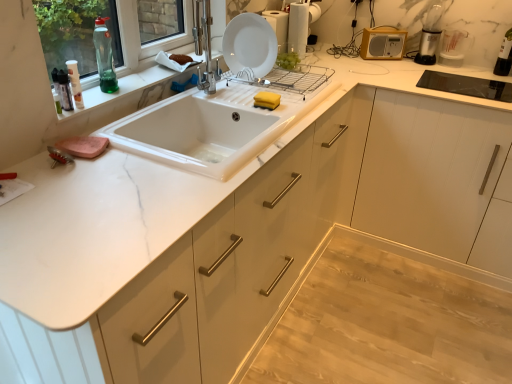
Where is `empty space that is in between translucent plastic spray bottle at upper left, placed as the 1th bottle when sorted from left to right, and green glass bottle at upper left, which is counted as the 2th bottle, starting from the back`? The image size is (512, 384). empty space that is in between translucent plastic spray bottle at upper left, placed as the 1th bottle when sorted from left to right, and green glass bottle at upper left, which is counted as the 2th bottle, starting from the back is located at coordinates (91, 95).